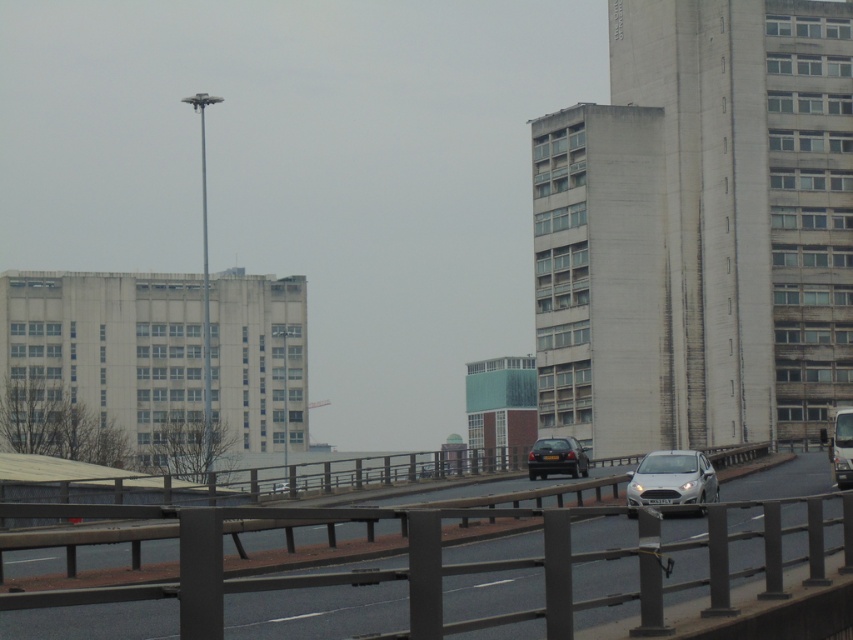
Consider the image. You are standing at the camera position and want to cross the road to reach the silver metallic car at center. The road has two lanes. The guardrails are on both sides. Can you safely cross the road to reach the car without entering any lanes?

The silver metallic car at center is 36.16 meters away from the camera position. Since the road has two lanes and guardrails on both sides, you can safely cross the road by staying between the guardrails and the lanes, ensuring you don not enter the traffic area. However, you must check for oncoming vehicles before proceeding.

You are a delivery driver who needs to know if your truck, which is as wide as the black glossy car at center, can safely pass through the metallic gray highway at center without any modifications. Can it fit?

The metallic gray highway at center is wider than the black glossy car at center, so the truck can safely pass through without any modifications.

You are a delivery driver who needs to park your truck, which is 2 meters wide, between the silver metallic car at center and the black glossy car at center. Can your truck fit in the space between them?

The silver metallic car at center has a lesser width compared to black glossy car at center, but the description does not provide the exact distance between them. Therefore, it is unclear if the truck can fit.